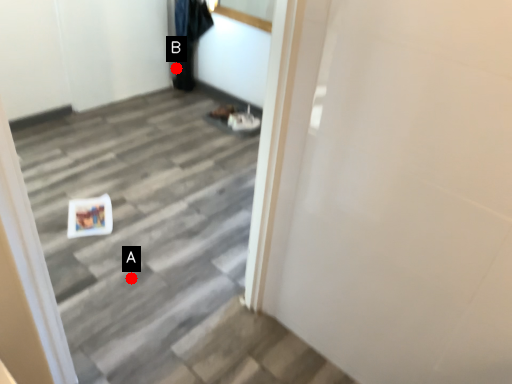
Question: Two points are circled on the image, labeled by A and B beside each circle. Which point appears closest to the camera in this image?

Choices:
 (A) A is closer
 (B) B is closer

Answer: (A)